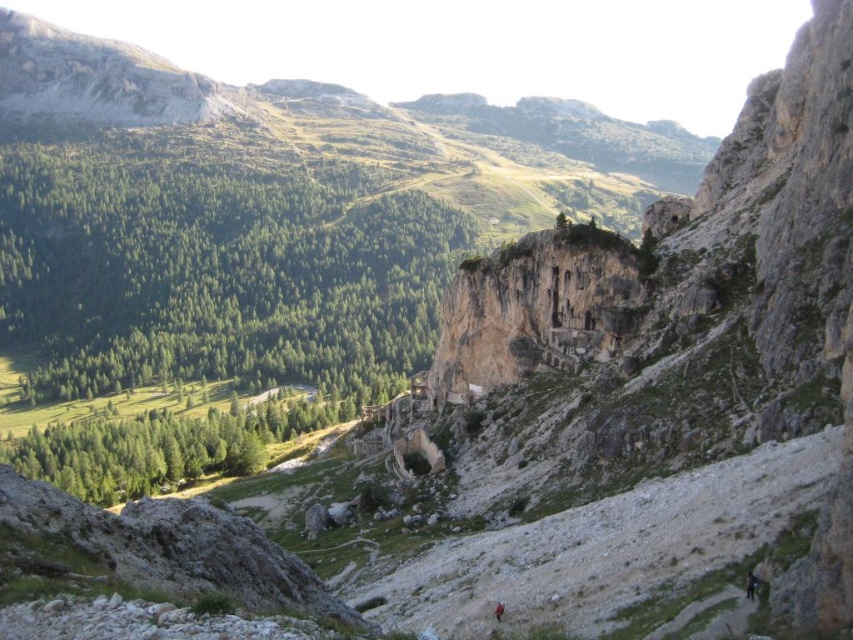
Which is in front, point (560, 280) or point (747, 593)?

Point (747, 593)

Is point (511, 381) positioned after point (747, 598)?

Yes, point (511, 381) is farther from viewer.

Locate an element on the screen. The height and width of the screenshot is (640, 853). brown rough rock face at center is located at coordinates (538, 307).